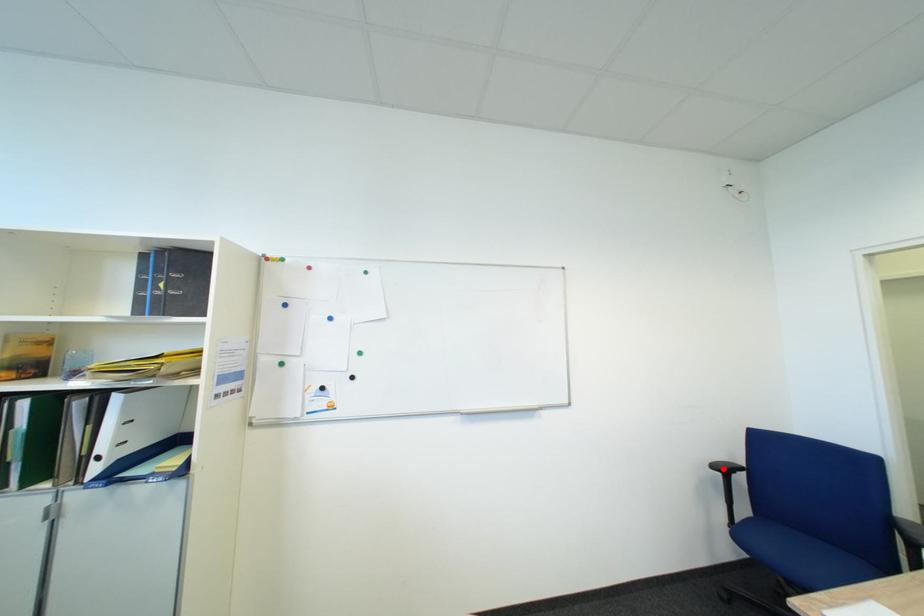
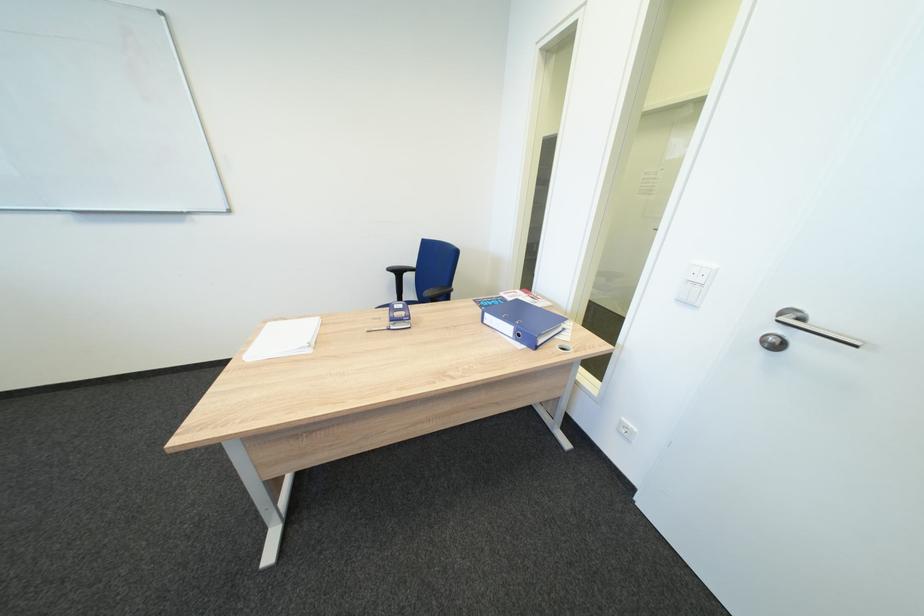
Find the pixel in the second image that matches the highlighted location in the first image.

(400, 270)